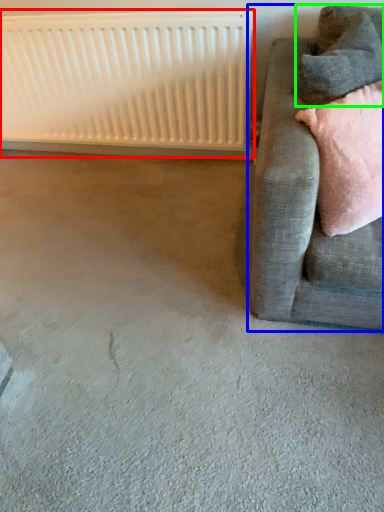
Question: Estimate the real-world distances between objects in this image. Which object is farther from radiator (highlighted by a red box), studio couch (highlighted by a blue box) or pillow (highlighted by a green box)?

Choices:
 (A) studio couch
 (B) pillow

Answer: (B)